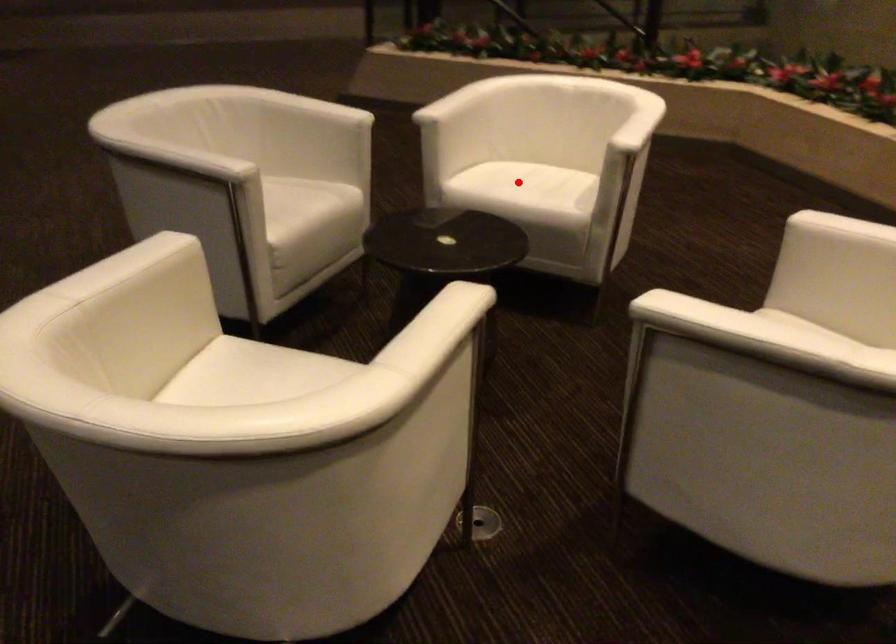
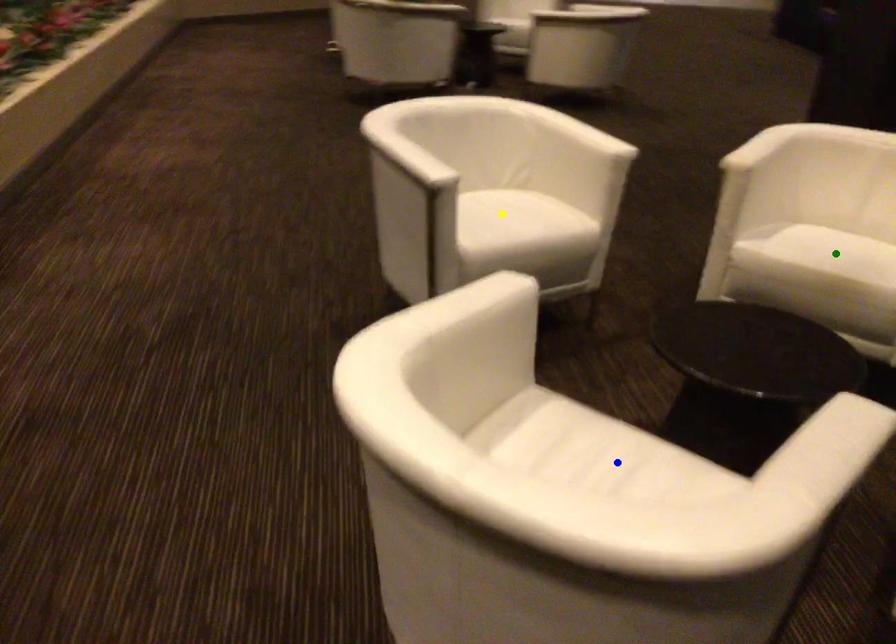
Question: I am providing you with two images of the same scene from different viewpoints. A red point is marked on the first image. You are given multiple points on the second image. Can you choose the point in image 2 that corresponds to the point in image 1?

Choices:
 (A) green point
 (B) blue point
 (C) yellow point

Answer: (B)